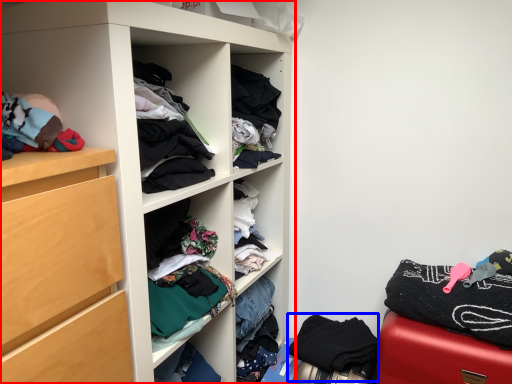
Question: Which point is further to the camera, cupboard (highlighted by a red box) or clothing (highlighted by a blue box)?

Choices:
 (A) cupboard
 (B) clothing

Answer: (B)